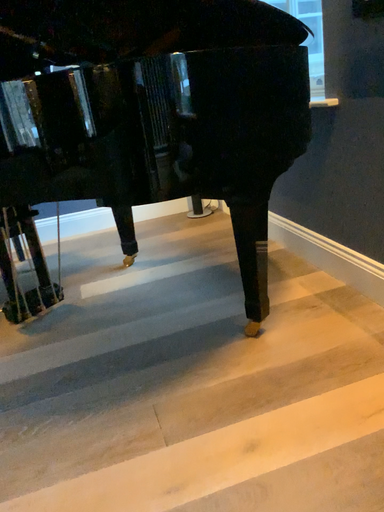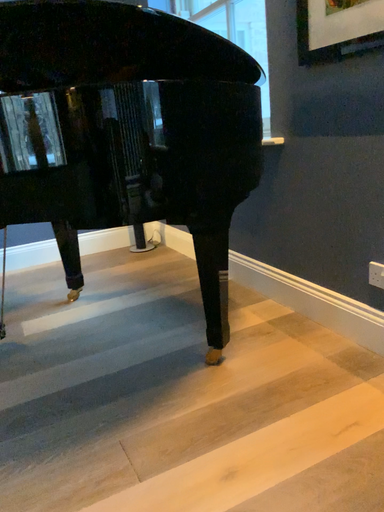
Question: How did the camera likely rotate when shooting the video?

Choices:
 (A) rotated left
 (B) rotated right

Answer: (B)